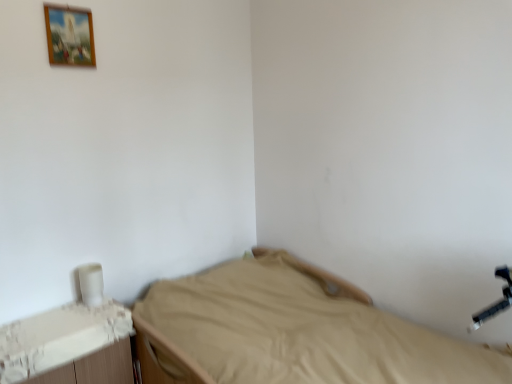
What are the coordinates of `empty space that is ontop of white plastic changing table at lower left (from a real-world perspective)` in the screenshot? It's located at (57, 324).